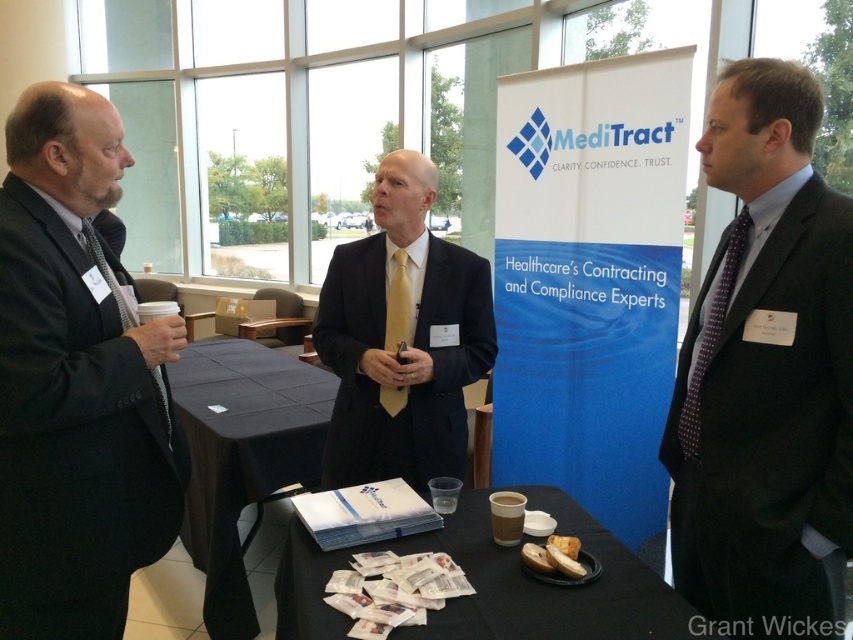
Question: Considering the real-world distances, which object is closest to the matte black suit at center?

Choices:
 (A) dark gray suit at right
 (B) purple dotted tie at right
 (C) yellow textured tie at center
 (D) black fabric table at lower left

Answer: (C)

Question: Is dark gray suit at right behind black paper plate at center?

Choices:
 (A) no
 (B) yes

Answer: (B)

Question: Which point is farther from the camera taking this photo?

Choices:
 (A) pos(746,236)
 (B) pos(100,531)
 (C) pos(372,362)
 (D) pos(566,627)

Answer: (C)

Question: Can you confirm if dark gray suit at right is positioned to the left of brown paper cup at center?

Choices:
 (A) yes
 (B) no

Answer: (B)

Question: Which object is farther from the camera taking this photo?

Choices:
 (A) black paper plate at center
 (B) purple dotted tie at right
 (C) dark gray suit at right
 (D) black suit at left

Answer: (B)

Question: Observing the image, what is the correct spatial positioning of purple dotted tie at right in reference to yellow textured tie at center?

Choices:
 (A) left
 (B) right

Answer: (B)